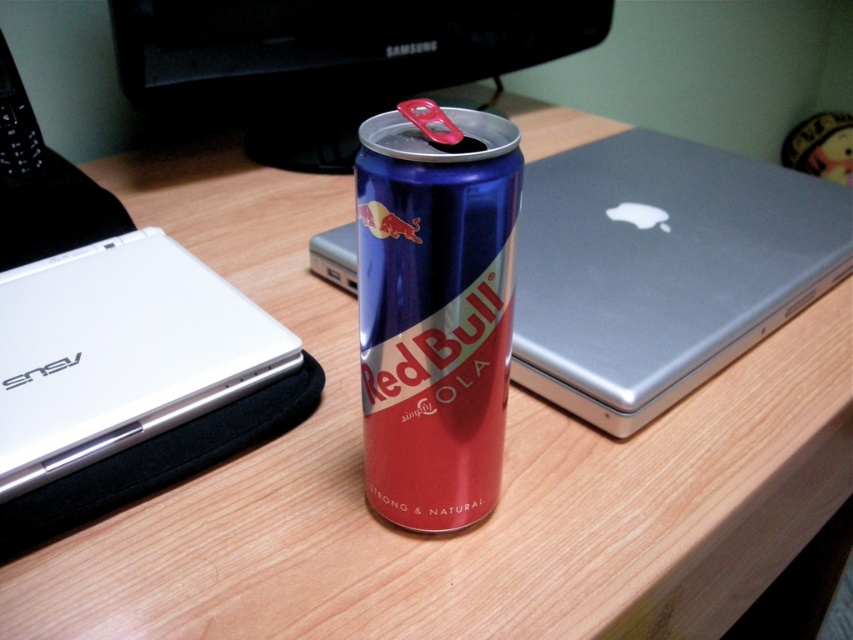
You are organizing items on a desk and need to place a new object at coordinates point A. The current metallic blue can at center is at point B. How should you adjust the can to make space?

The metallic blue can at center is located at point B, so you should move it to a different position to create space for the new object at point A.

You are organizing a desk and need to place both the sleek silver laptop at center and the metallic blue can at center. If you want to place the larger item closer to you, which object should you put nearer?

The sleek silver laptop at center is larger than the metallic blue can at center, so you should place the sleek silver laptop at center closer to you.

You are organizing a tech event and need to place the Red Bull can between the metallic silver laptop at center and the white matte laptop at left. According to their positions, which laptop should the can be placed closer to?

The metallic silver laptop at center is to the right of the white matte laptop at left. Therefore, the Red Bull can should be placed closer to the metallic silver laptop at center to maintain proper spacing between the two laptops.